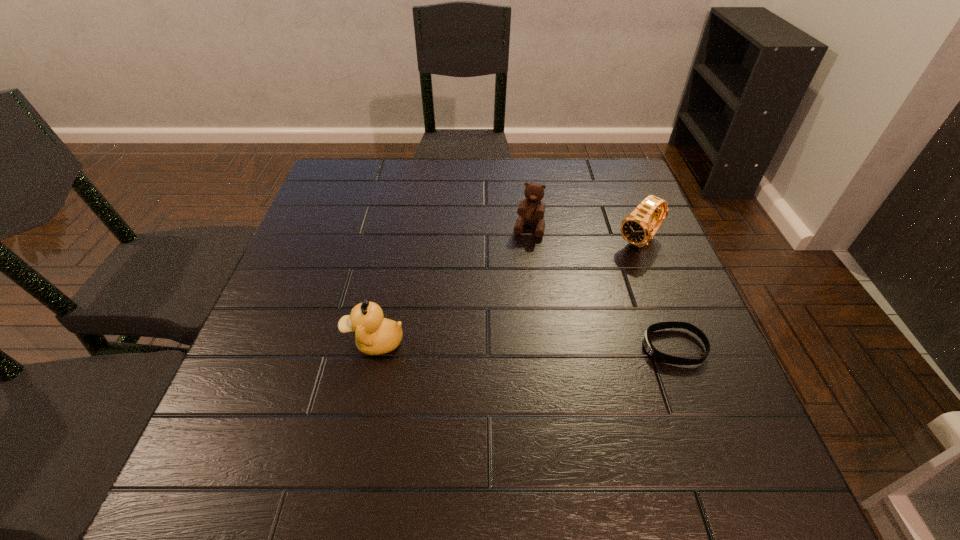
This screenshot has width=960, height=540. Identify the location of free space at the left edge of the desktop. (349, 259).

In the image, there is a desktop. At what (x,y) coordinates should I click in order to perform the action: click on free space at the right edge. Please return your answer as a coordinate pair (x, y). Image resolution: width=960 pixels, height=540 pixels. Looking at the image, I should click on (617, 263).

You are a GUI agent. You are given a task and a screenshot of the screen. Output one action in this format:
    pyautogui.click(x=<x>, y=<y>)
    Task: Click on the free space at the far left corner of the desktop
    This screenshot has height=540, width=960.
    Given the screenshot: What is the action you would take?
    pyautogui.click(x=352, y=178)

This screenshot has height=540, width=960. I want to click on free spot at the near left corner of the desktop, so click(x=289, y=394).

At what (x,y) coordinates should I click in order to perform the action: click on blank area at the far right corner. Please return your answer as a coordinate pair (x, y). This screenshot has height=540, width=960. Looking at the image, I should click on (584, 159).

Locate an element on the screen. Image resolution: width=960 pixels, height=540 pixels. blank region between the teddy bear and the wristband is located at coordinates (601, 288).

Where is `free spot between the third object from right to left and the watch`? Image resolution: width=960 pixels, height=540 pixels. free spot between the third object from right to left and the watch is located at coordinates (585, 235).

Locate an element on the screen. free space between the shortest object and the teddy bear is located at coordinates (601, 288).

Where is `free spot between the wristband and the teddy bear`? free spot between the wristband and the teddy bear is located at coordinates (601, 288).

Where is `empty location between the watch and the leftmost object`? The height and width of the screenshot is (540, 960). empty location between the watch and the leftmost object is located at coordinates (507, 292).